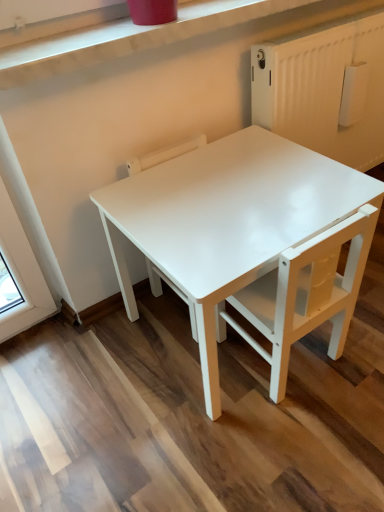
Question: Considering the relative positions of white matte chair at center, which appears as the 1th chair when viewed from the right, and white glossy chair at center, which appears as the first chair when viewed from the left, in the image provided, is white matte chair at center, which appears as the 1th chair when viewed from the right, to the left of white glossy chair at center, which appears as the first chair when viewed from the left, from the viewer's perspective?

Choices:
 (A) no
 (B) yes

Answer: (A)

Question: Is white matte chair at center, which appears as the 1th chair when viewed from the right, closer to the viewer compared to white glossy chair at center, which appears as the first chair when viewed from the left?

Choices:
 (A) no
 (B) yes

Answer: (B)

Question: From the image's perspective, is white matte chair at center, which is the 2th chair in left-to-right order, located above white glossy chair at center, which is the 2th chair in right-to-left order?

Choices:
 (A) no
 (B) yes

Answer: (A)

Question: Is white matte chair at center, which is the 2th chair in left-to-right order, placed right next to white glossy chair at center, which is the 2th chair in right-to-left order?

Choices:
 (A) no
 (B) yes

Answer: (A)

Question: Is white matte chair at center, which is the 2th chair in left-to-right order, located outside white glossy chair at center, which is the 2th chair in right-to-left order?

Choices:
 (A) no
 (B) yes

Answer: (B)

Question: Visually, is white matte chair at center, which appears as the 1th chair when viewed from the right, positioned to the left or to the right of white glossy table at center?

Choices:
 (A) left
 (B) right

Answer: (B)

Question: Looking at the image, does white matte chair at center, which appears as the 1th chair when viewed from the right, seem bigger or smaller compared to white glossy table at center?

Choices:
 (A) big
 (B) small

Answer: (B)

Question: Looking at their shapes, would you say white matte chair at center, which is the 2th chair in left-to-right order, is wider or thinner than white glossy table at center?

Choices:
 (A) thin
 (B) wide

Answer: (A)

Question: In the image, is white matte chair at center, which is the 2th chair in left-to-right order, positioned in front of or behind white glossy table at center?

Choices:
 (A) front
 (B) behind

Answer: (B)

Question: Relative to white matte chair at center, which appears as the 1th chair when viewed from the right, is white glossy chair at center, which appears as the first chair when viewed from the left, in front or behind?

Choices:
 (A) front
 (B) behind

Answer: (B)

Question: Is point (162, 154) positioned closer to the camera than point (360, 212)?

Choices:
 (A) farther
 (B) closer

Answer: (A)

Question: From the image's perspective, is white glossy chair at center, which is the 2th chair in right-to-left order, located above or below white matte chair at center, which appears as the 1th chair when viewed from the right?

Choices:
 (A) above
 (B) below

Answer: (A)

Question: From a real-world perspective, is white glossy chair at center, which appears as the first chair when viewed from the left, physically located above or below white matte chair at center, which is the 2th chair in left-to-right order?

Choices:
 (A) below
 (B) above

Answer: (B)

Question: From the image's perspective, is white matte chair at center, which is the 2th chair in left-to-right order, above or below white glossy chair at center, which appears as the first chair when viewed from the left?

Choices:
 (A) above
 (B) below

Answer: (B)

Question: Looking at their shapes, would you say white matte chair at center, which is the 2th chair in left-to-right order, is wider or thinner than white glossy chair at center, which is the 2th chair in right-to-left order?

Choices:
 (A) thin
 (B) wide

Answer: (B)